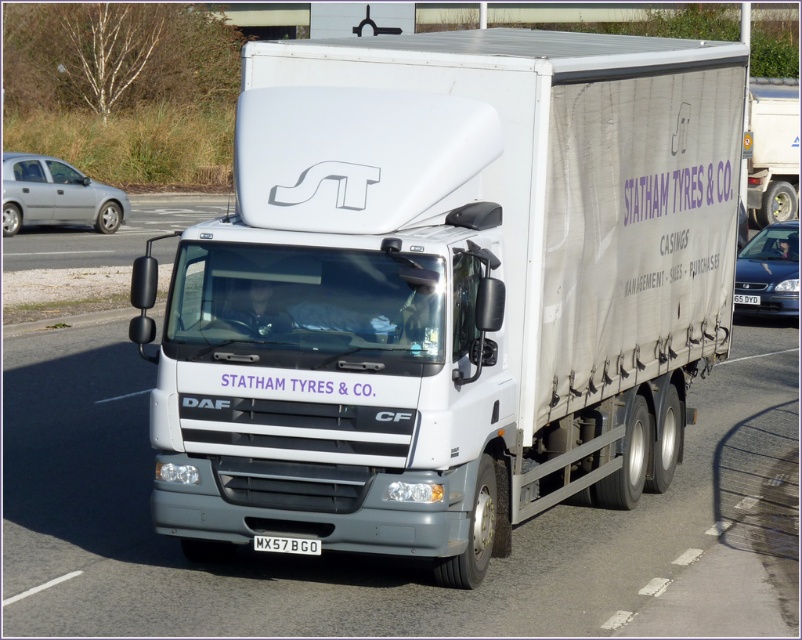
You are a driver approaching the intersection ahead. You see a silver metallic sedan at left and a metallic blue sedan at right. Which car is taller?

The silver metallic sedan at left is much taller than the metallic blue sedan at right.

You are a photographer standing in front of the white DAF CF truck. You notice a silver metallic sedan at left and a black metal license plate at center. Which object is taller?

The silver metallic sedan at left is much taller than the black metal license plate at center.